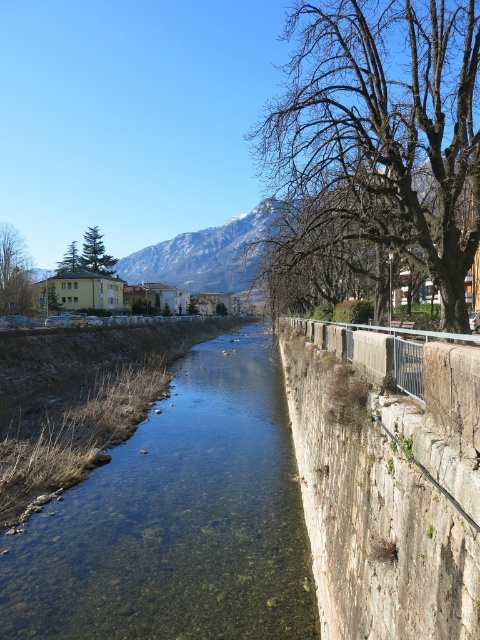
Is green leafy tree at left below green leafy tree at upper left?

Yes.

Consider the image. Between green leafy tree at left and green leafy tree at upper left, which one is positioned lower?

green leafy tree at left is below.

Is point (22, 257) farther from viewer compared to point (71, 259)?

No, (22, 257) is in front of (71, 259).

Identify the location of green leafy tree at left. (13, 273).

Can you confirm if clear water at center is positioned to the left of green leafy tree at left?

Incorrect, clear water at center is not on the left side of green leafy tree at left.

In order to click on clear water at center in this screenshot , I will do `click(177, 520)`.

Locate an element on the screen. bare branches at upper right is located at coordinates (384, 131).

Looking at this image, who is lower down, bare branches at upper right or green leafy tree at left?

green leafy tree at left is below.

Find the location of a particular element. bare branches at upper right is located at coordinates (384, 131).